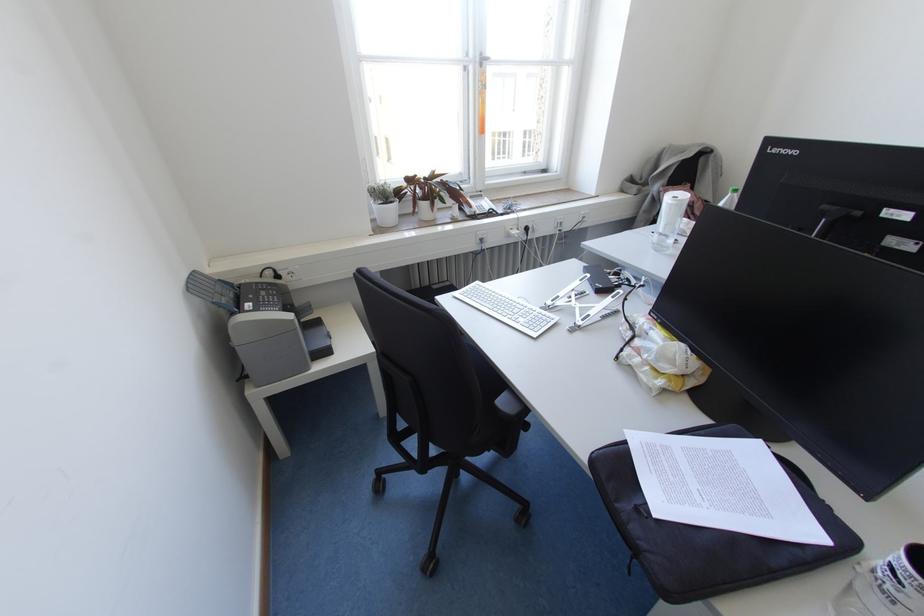
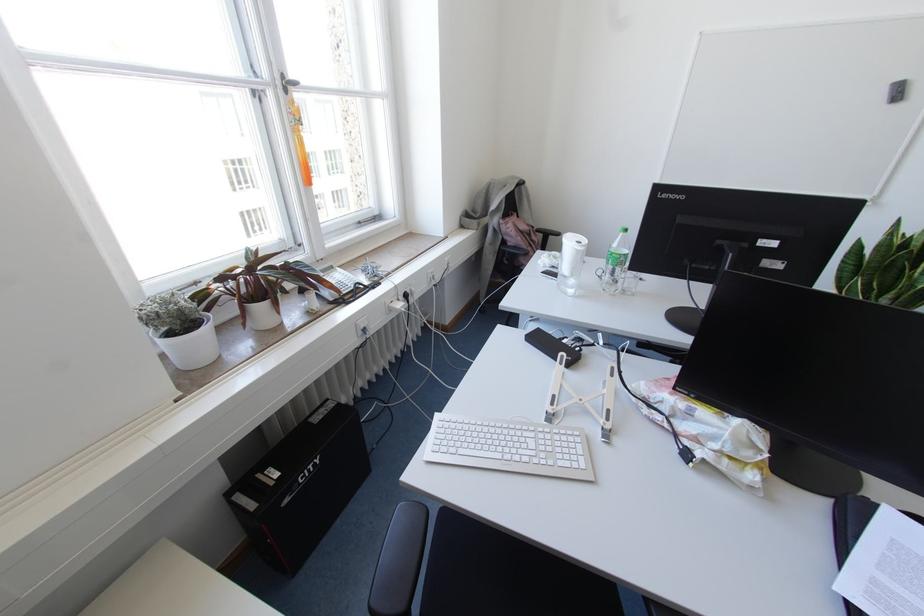
Find the pixel in the second image that matches (480,65) in the first image.

(285, 90)